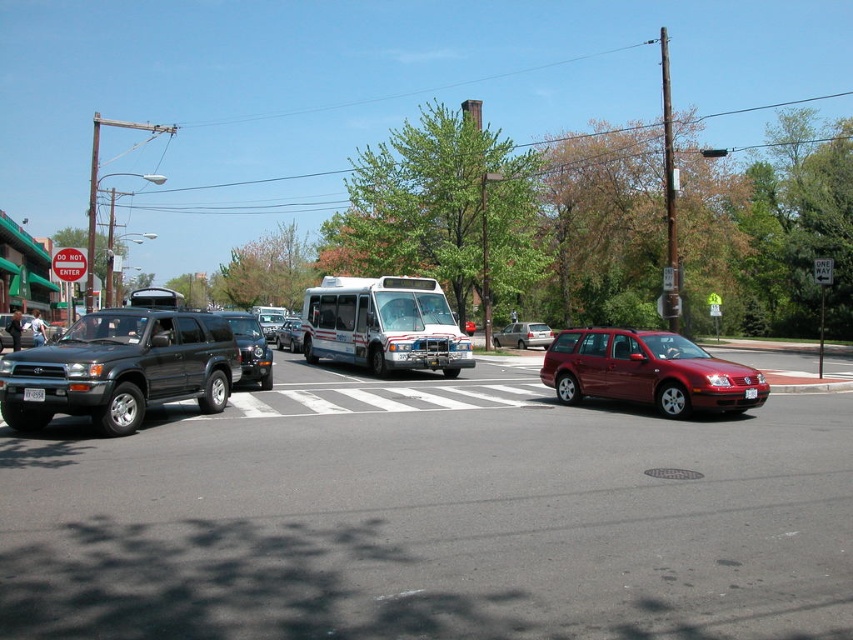
Does matte black suv at left appear on the right side of metallic red sedan at center?

Incorrect, matte black suv at left is not on the right side of metallic red sedan at center.

In the scene shown: Can you confirm if matte black suv at left is shorter than metallic red sedan at center?

In fact, matte black suv at left may be taller than metallic red sedan at center.

This screenshot has height=640, width=853. What do you see at coordinates (120, 369) in the screenshot? I see `matte black suv at left` at bounding box center [120, 369].

What are the coordinates of `matte black suv at left` in the screenshot? It's located at (120, 369).

Is matte black suv at center shorter than white plastic license plate at center?

No.

Is the position of matte black suv at center less distant than that of white plastic license plate at center?

That is False.

Find the location of a particular element. matte black suv at center is located at coordinates (250, 348).

Find the location of a particular element. matte black suv at center is located at coordinates (250, 348).

Between metallic red sedan at center and metallic silver suv at center, which one appears on the right side from the viewer's perspective?

Positioned to the right is metallic red sedan at center.

Does metallic red sedan at center have a larger size compared to metallic silver suv at center?

Indeed, metallic red sedan at center has a larger size compared to metallic silver suv at center.

Image resolution: width=853 pixels, height=640 pixels. In order to click on metallic red sedan at center in this screenshot , I will do `click(523, 336)`.